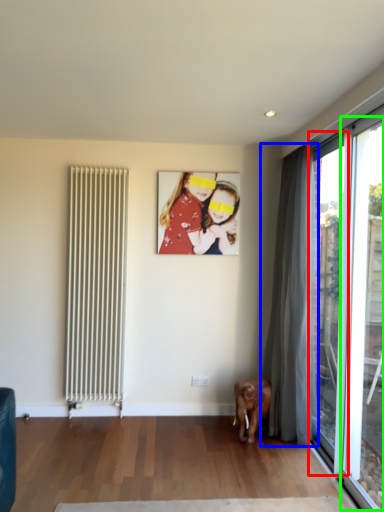
Question: Considering the real-world distances, which object is closest to window (highlighted by a red box)? curtain (highlighted by a blue box) or window (highlighted by a green box).

Choices:
 (A) curtain
 (B) window

Answer: (A)